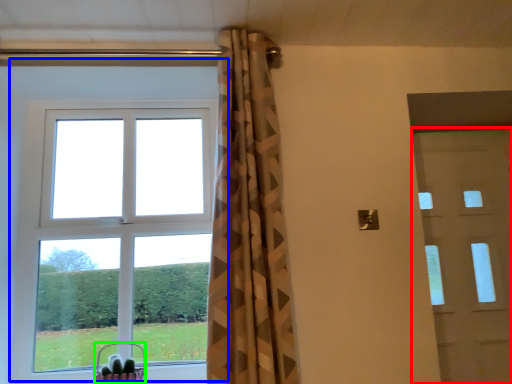
Question: Which object is the closest to the door (highlighted by a red box)? Choose among these: window (highlighted by a blue box) or basket (highlighted by a green box).

Choices:
 (A) window
 (B) basket

Answer: (A)